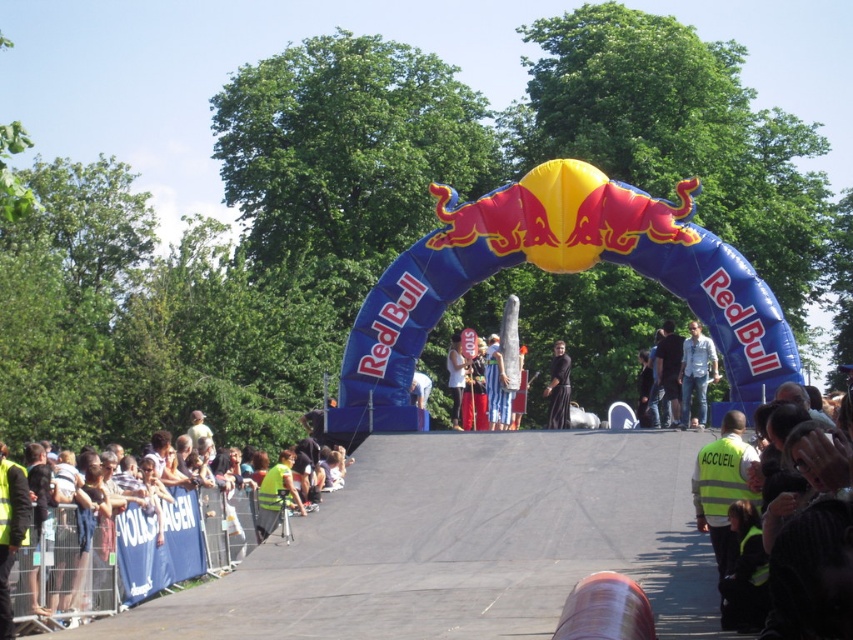
From the picture: You are a photographer at the event and want to capture a photo of the black cloth at center without the yellow reflective vests at lower left blocking the view. Based on their heights, can you adjust your camera angle to achieve this?

The yellow reflective vests at lower left has a greater height compared to black cloth at center. By lowering the camera angle, you can position the camera closer to the ground so that the lower height of the black cloth at center is visible while the taller yellow reflective vests at lower left are out of frame.

You are a safety inspector at the event. You need to determine if the yellow reflective vests at lower left can be fully covered by the black cloth at center for storage. Based on their sizes, what is your conclusion?

The yellow reflective vests at lower left is bigger than the black cloth at center, so the black cloth at center cannot fully cover the yellow reflective vests at lower left for storage.